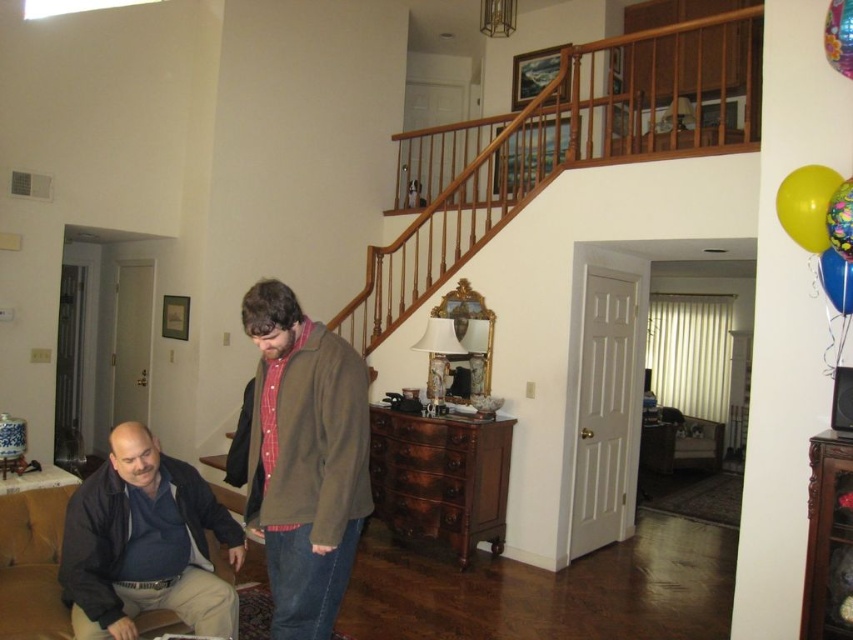
Question: Is dark blue jacket at lower left to the left of rubberized yellow balloon at upper right from the viewer's perspective?

Choices:
 (A) yes
 (B) no

Answer: (A)

Question: Which object appears farthest from the camera in this image?

Choices:
 (A) yellow rubber balloon at upper right
 (B) brown woolen sweater at center
 (C) rubberized yellow balloon at upper right

Answer: (A)

Question: Which object is closer to the camera taking this photo?

Choices:
 (A) dark blue jacket at lower left
 (B) shiny metallic balloon at upper right
 (C) yellow matte balloon at upper right
 (D) rubberized yellow balloon at upper right

Answer: (D)

Question: Is brown woolen sweater at center thinner than shiny metallic balloon at upper right?

Choices:
 (A) yes
 (B) no

Answer: (B)

Question: Is brown woolen sweater at center above dark blue jacket at lower left?

Choices:
 (A) no
 (B) yes

Answer: (B)

Question: Which object is positioned closest to the rubberized yellow balloon at upper right?

Choices:
 (A) dark blue jacket at lower left
 (B) shiny metallic balloon at upper right

Answer: (B)